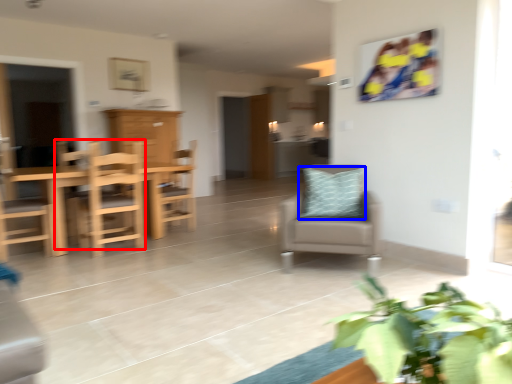
Question: Which object appears farthest to the camera in this image, chair (highlighted by a red box) or pillow (highlighted by a blue box)?

Choices:
 (A) chair
 (B) pillow

Answer: (A)